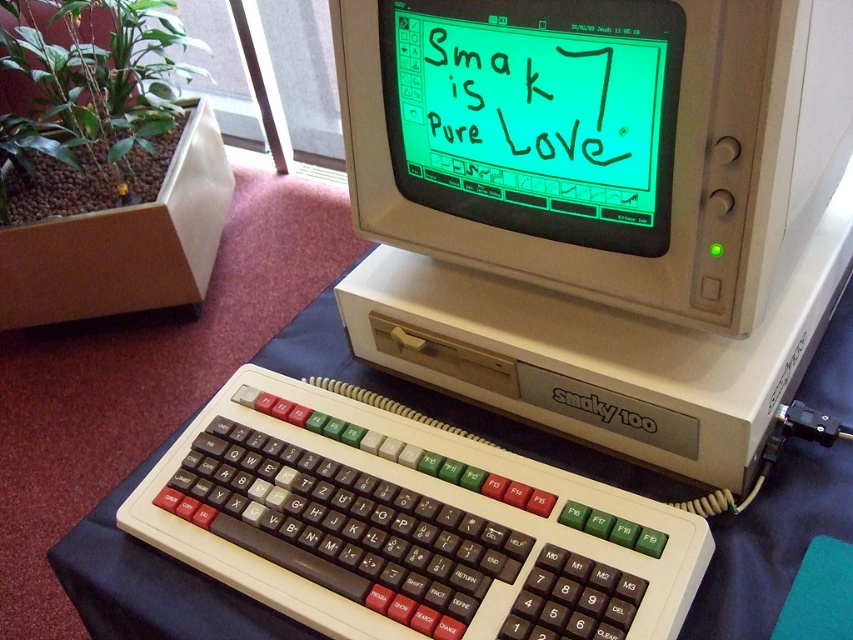
You are a technician repairing the Smaky 100 computer. You need to locate the monitor to check its display. Where is the green matte monitor at center located in terms of coordinates?

The green matte monitor at center is located at coordinates point (537,113).

You are setting up a display for a retro computing exhibition. You have a brown plastic keyboard at center and a black plastic Smaky 100 at center. The table has limited space. Which object requires more horizontal space due to its width?

The brown plastic keyboard at center requires more horizontal space because its width is larger than the black plastic Smaky 100 at center.

You are a technician who needs to inspect the beige plastic smaky 100 at center. The minimum distance you can safely work on such equipment is 18 inches. Can you safely perform the inspection from your current position?

The beige plastic smaky 100 at center is 17.36 inches away from viewer, which is less than the required 18 inches. Therefore, you need to move back to ensure a safe working distance.